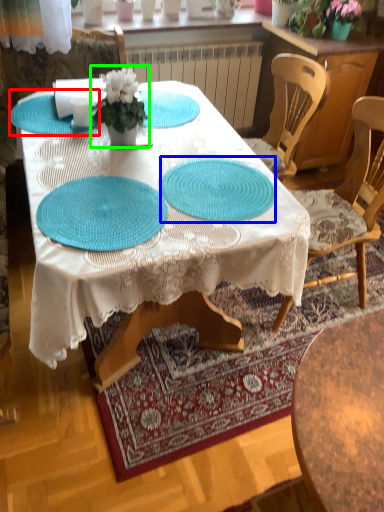
Question: Which object is positioned farthest from glass plate (highlighted by a red box)? Select from glass plate (highlighted by a blue box) and houseplant (highlighted by a green box).

Choices:
 (A) glass plate
 (B) houseplant

Answer: (A)